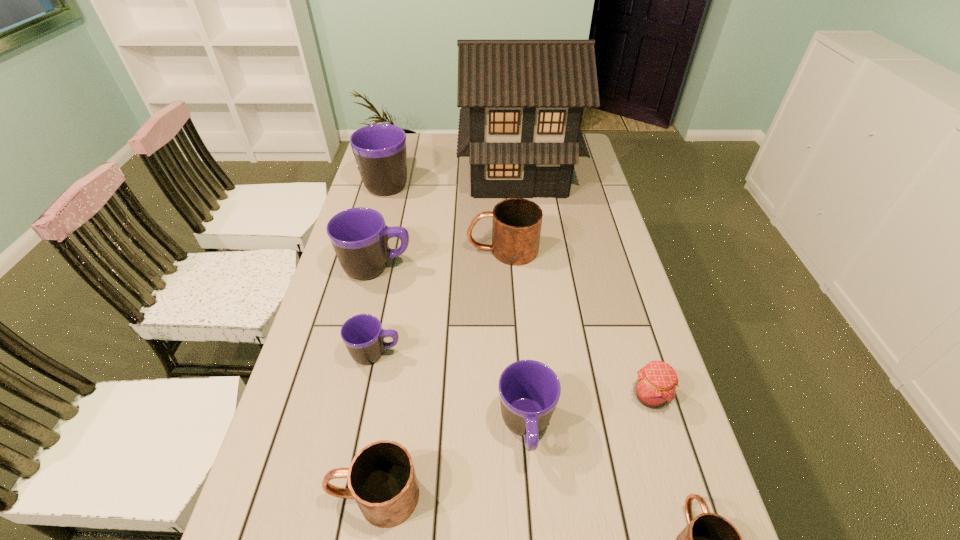
You are a GUI agent. You are given a task and a screenshot of the screen. Output one action in this format:
    pyautogui.click(x=<x>, y=<y>)
    Task: Click on the dollhouse
    The width and height of the screenshot is (960, 540).
    Given the screenshot: What is the action you would take?
    pyautogui.click(x=522, y=101)

Identify the location of black dollhouse. Image resolution: width=960 pixels, height=540 pixels. (522, 101).

At what (x,y) coordinates should I click in order to perform the action: click on the farthest mug. Please return your answer as a coordinate pair (x, y). Looking at the image, I should click on [x=380, y=152].

The height and width of the screenshot is (540, 960). I want to click on the farthest black mug, so click(380, 152).

Identify the location of the third smallest black mug. This screenshot has width=960, height=540. (359, 236).

You are a GUI agent. You are given a task and a screenshot of the screen. Output one action in this format:
    pyautogui.click(x=<x>, y=<y>)
    Task: Click on the biggest rust mug
    The image size is (960, 540).
    Given the screenshot: What is the action you would take?
    pyautogui.click(x=516, y=227)

Locate an element on the screen. the second rust mug from right to left is located at coordinates tap(516, 227).

Where is `the second smallest black mug`? Image resolution: width=960 pixels, height=540 pixels. the second smallest black mug is located at coordinates (529, 390).

Find the location of `the rightmost black mug`. the rightmost black mug is located at coordinates coord(529,390).

Image resolution: width=960 pixels, height=540 pixels. Find the location of `the leftmost rust mug`. the leftmost rust mug is located at coordinates (381, 478).